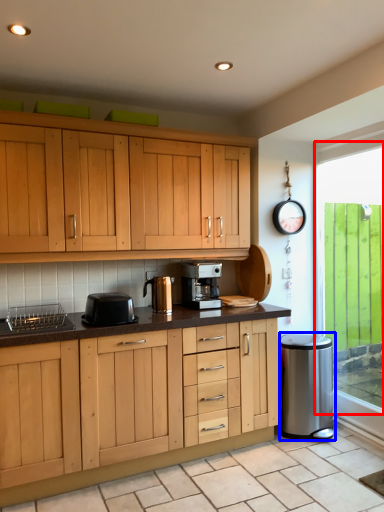
Question: Which object appears closest to the camera in this image, window (highlighted by a red box) or appliance (highlighted by a blue box)?

Choices:
 (A) window
 (B) appliance

Answer: (A)